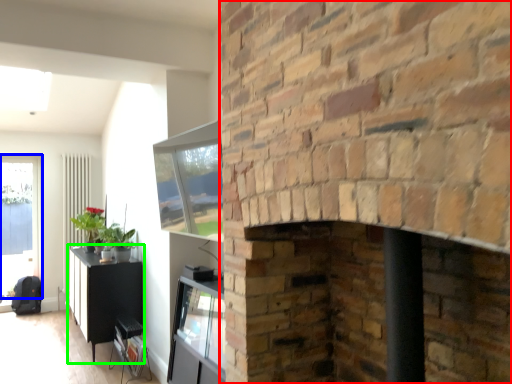
Question: Which object is the closest to the fireplace (highlighted by a red box)? Choose among these: window (highlighted by a blue box) or table (highlighted by a green box).

Choices:
 (A) window
 (B) table

Answer: (B)